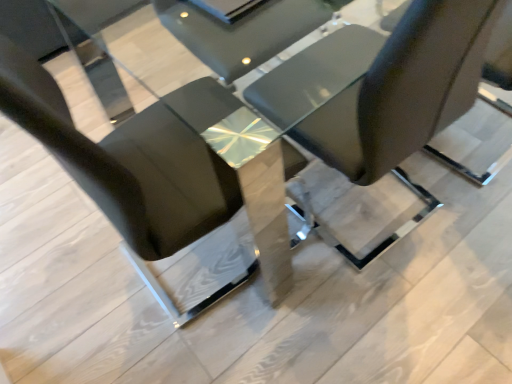
Image resolution: width=512 pixels, height=384 pixels. Describe the element at coordinates (388, 115) in the screenshot. I see `matte black chair at center, the 1th chair in the right-to-left sequence` at that location.

You are a GUI agent. You are given a task and a screenshot of the screen. Output one action in this format:
    pyautogui.click(x=<x>, y=<y>)
    Task: Click on the matte black chair at center, the second chair in the left-to-right sequence
    The height and width of the screenshot is (384, 512).
    Given the screenshot: What is the action you would take?
    pyautogui.click(x=388, y=115)

Image resolution: width=512 pixels, height=384 pixels. In order to click on black leather chair at center, which is the 2th chair from right to left in this screenshot , I will do `click(145, 188)`.

Describe the element at coordinates (145, 188) in the screenshot. I see `black leather chair at center, which is the 2th chair from right to left` at that location.

At what (x,y) coordinates should I click in order to perform the action: click on matte black chair at center, the second chair in the left-to-right sequence. Please return your answer as a coordinate pair (x, y). The width and height of the screenshot is (512, 384). Looking at the image, I should click on (388, 115).

Considering the positions of objects black leather chair at center, arranged as the 1th chair when viewed from the left, and matte black chair at center, the second chair in the left-to-right sequence, in the image provided, who is more to the right, black leather chair at center, arranged as the 1th chair when viewed from the left, or matte black chair at center, the second chair in the left-to-right sequence,?

From the viewer's perspective, matte black chair at center, the second chair in the left-to-right sequence, appears more on the right side.

Is black leather chair at center, arranged as the 1th chair when viewed from the left, in front of or behind matte black chair at center, the 1th chair in the right-to-left sequence, in the image?

black leather chair at center, arranged as the 1th chair when viewed from the left, is in front of matte black chair at center, the 1th chair in the right-to-left sequence.

Does point (119, 215) appear closer or farther from the camera than point (452, 81)?

Point (119, 215) appears to be closer to the viewer than point (452, 81).

In the scene shown: From the image's perspective, is black leather chair at center, arranged as the 1th chair when viewed from the left, under matte black chair at center, the 1th chair in the right-to-left sequence?

Indeed, from the image's perspective, black leather chair at center, arranged as the 1th chair when viewed from the left, is shown beneath matte black chair at center, the 1th chair in the right-to-left sequence.

From a real-world perspective, is black leather chair at center, arranged as the 1th chair when viewed from the left, physically above matte black chair at center, the second chair in the left-to-right sequence?

Yes, from a real-world perspective, black leather chair at center, arranged as the 1th chair when viewed from the left, is above matte black chair at center, the second chair in the left-to-right sequence.

Between black leather chair at center, arranged as the 1th chair when viewed from the left, and matte black chair at center, the 1th chair in the right-to-left sequence, which one has larger width?

With larger width is black leather chair at center, arranged as the 1th chair when viewed from the left.

Does black leather chair at center, which is the 2th chair from right to left, have a greater height compared to matte black chair at center, the second chair in the left-to-right sequence?

Correct, black leather chair at center, which is the 2th chair from right to left, is much taller as matte black chair at center, the second chair in the left-to-right sequence.

Who is bigger, black leather chair at center, arranged as the 1th chair when viewed from the left, or matte black chair at center, the second chair in the left-to-right sequence?

black leather chair at center, arranged as the 1th chair when viewed from the left.

Would you say matte black chair at center, the second chair in the left-to-right sequence, is part of black leather chair at center, arranged as the 1th chair when viewed from the left,'s contents?

No, matte black chair at center, the second chair in the left-to-right sequence, is located outside of black leather chair at center, arranged as the 1th chair when viewed from the left.

Is black leather chair at center, which is the 2th chair from right to left, not near matte black chair at center, the 1th chair in the right-to-left sequence?

black leather chair at center, which is the 2th chair from right to left, is near matte black chair at center, the 1th chair in the right-to-left sequence, not far away.

Could you tell me if black leather chair at center, arranged as the 1th chair when viewed from the left, is facing matte black chair at center, the second chair in the left-to-right sequence?

Yes.

You are a GUI agent. You are given a task and a screenshot of the screen. Output one action in this format:
    pyautogui.click(x=<x>, y=<y>)
    Task: Click on the chair above the black leather chair at center, arranged as the 1th chair when viewed from the left (from the image's perspective)
    
    Given the screenshot: What is the action you would take?
    pyautogui.click(x=388, y=115)

Looking at this image, considering the positions of objects matte black chair at center, the 1th chair in the right-to-left sequence, and black leather chair at center, arranged as the 1th chair when viewed from the left, in the image provided, who is more to the left, matte black chair at center, the 1th chair in the right-to-left sequence, or black leather chair at center, arranged as the 1th chair when viewed from the left,?

black leather chair at center, arranged as the 1th chair when viewed from the left, is more to the left.

Considering the positions of objects matte black chair at center, the 1th chair in the right-to-left sequence, and black leather chair at center, arranged as the 1th chair when viewed from the left, in the image provided, who is behind, matte black chair at center, the 1th chair in the right-to-left sequence, or black leather chair at center, arranged as the 1th chair when viewed from the left,?

Positioned behind is matte black chair at center, the 1th chair in the right-to-left sequence.

Which is closer, (473, 121) or (156, 150)?

The point (156, 150) is more forward.

From the image's perspective, relative to black leather chair at center, which is the 2th chair from right to left, is matte black chair at center, the 1th chair in the right-to-left sequence, above or below?

matte black chair at center, the 1th chair in the right-to-left sequence, is above black leather chair at center, which is the 2th chair from right to left.

From a real-world perspective, is matte black chair at center, the 1th chair in the right-to-left sequence, positioned above or below black leather chair at center, arranged as the 1th chair when viewed from the left?

matte black chair at center, the 1th chair in the right-to-left sequence, is below black leather chair at center, arranged as the 1th chair when viewed from the left.

Looking at their sizes, would you say matte black chair at center, the 1th chair in the right-to-left sequence, is wider or thinner than black leather chair at center, which is the 2th chair from right to left?

In the image, matte black chair at center, the 1th chair in the right-to-left sequence, appears to be more narrow than black leather chair at center, which is the 2th chair from right to left.

Based on the photo, is matte black chair at center, the 1th chair in the right-to-left sequence, taller or shorter than black leather chair at center, arranged as the 1th chair when viewed from the left?

Considering their sizes, matte black chair at center, the 1th chair in the right-to-left sequence, has less height than black leather chair at center, arranged as the 1th chair when viewed from the left.

Who is smaller, matte black chair at center, the 1th chair in the right-to-left sequence, or black leather chair at center, which is the 2th chair from right to left?

matte black chair at center, the 1th chair in the right-to-left sequence.

Is black leather chair at center, which is the 2th chair from right to left, located within matte black chair at center, the second chair in the left-to-right sequence?

No, matte black chair at center, the second chair in the left-to-right sequence, does not contain black leather chair at center, which is the 2th chair from right to left.

Are matte black chair at center, the second chair in the left-to-right sequence, and black leather chair at center, which is the 2th chair from right to left, located far from each other?

They are positioned close to each other.

Is black leather chair at center, which is the 2th chair from right to left, at the back of matte black chair at center, the 1th chair in the right-to-left sequence?

No, matte black chair at center, the 1th chair in the right-to-left sequence,'s orientation is not away from black leather chair at center, which is the 2th chair from right to left.

How different are the orientations of matte black chair at center, the 1th chair in the right-to-left sequence, and black leather chair at center, which is the 2th chair from right to left, in degrees?

The facing directions of matte black chair at center, the 1th chair in the right-to-left sequence, and black leather chair at center, which is the 2th chair from right to left, are 84.5 degrees apart.

Locate an element on the screen. chair lying behind the black leather chair at center, which is the 2th chair from right to left is located at coordinates (388, 115).

This screenshot has height=384, width=512. I want to click on chair behind the black leather chair at center, arranged as the 1th chair when viewed from the left, so click(388, 115).

At what (x,y) coordinates should I click in order to perform the action: click on chair in front of the matte black chair at center, the second chair in the left-to-right sequence. Please return your answer as a coordinate pair (x, y). This screenshot has width=512, height=384. Looking at the image, I should click on (145, 188).